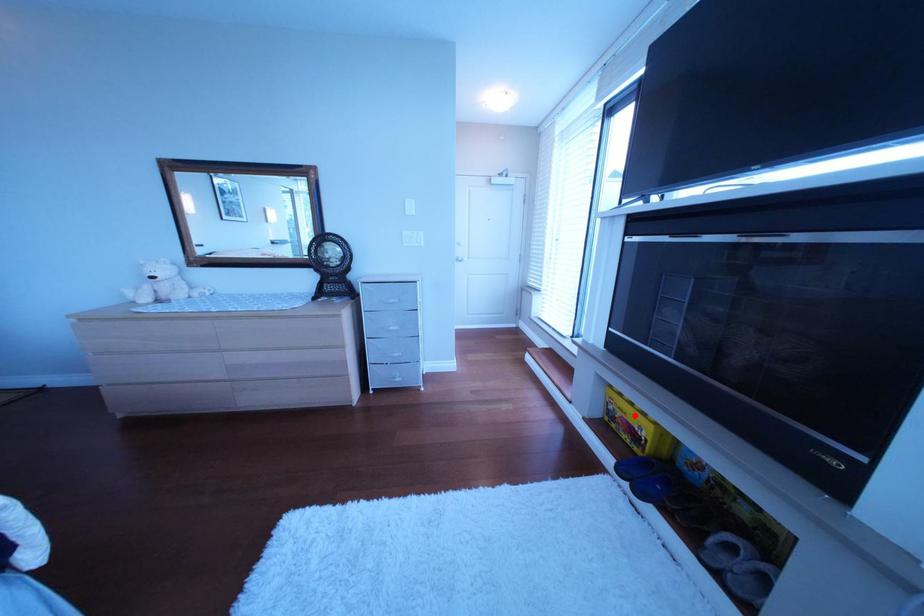
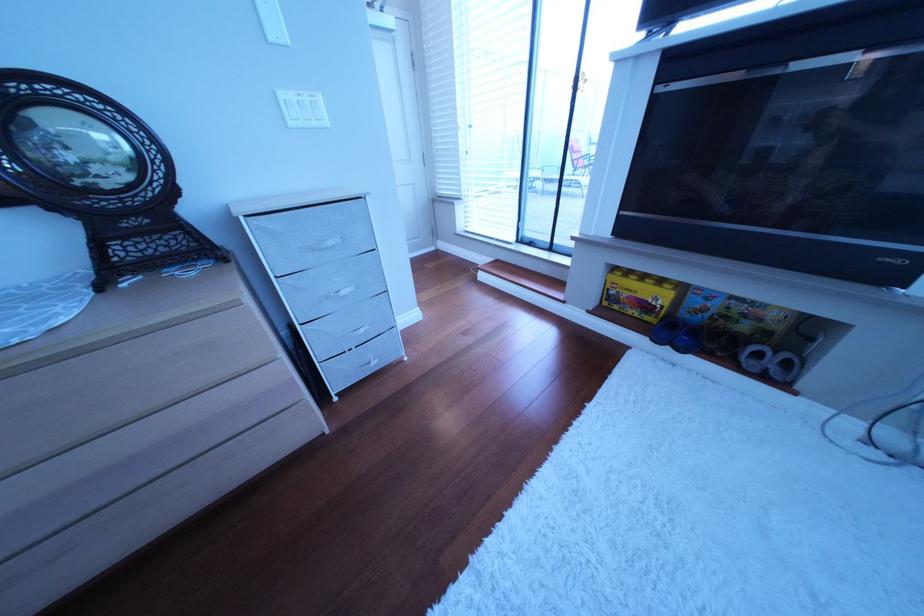
Question: A red point is marked in image1. In image2, is the corresponding 3D point closer to the camera or farther? Reply with the corresponding letter.

Choices:
 (A) The corresponding 3D point is closer.
 (B) The corresponding 3D point is farther.

Answer: (A)